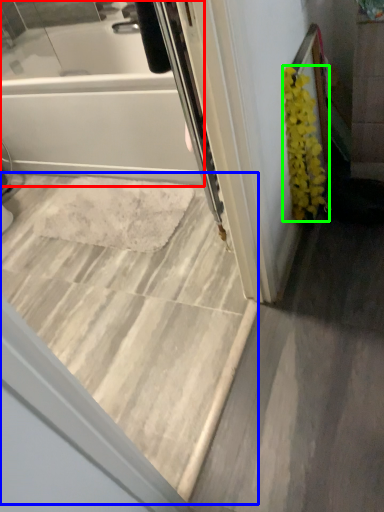
Question: Based on their relative distances, which object is nearer to bathtub (highlighted by a red box)? Choose from stairwell (highlighted by a blue box) and flower (highlighted by a green box).

Choices:
 (A) stairwell
 (B) flower

Answer: (A)